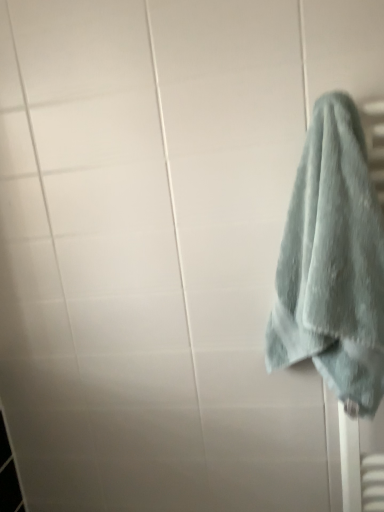
The height and width of the screenshot is (512, 384). Describe the element at coordinates (333, 262) in the screenshot. I see `soft blue towel at right` at that location.

What is the approximate height of soft blue towel at right?

It is 25.46 inches.

In order to click on soft blue towel at right in this screenshot , I will do `click(333, 262)`.

Image resolution: width=384 pixels, height=512 pixels. In order to click on soft blue towel at right in this screenshot , I will do (x=333, y=262).